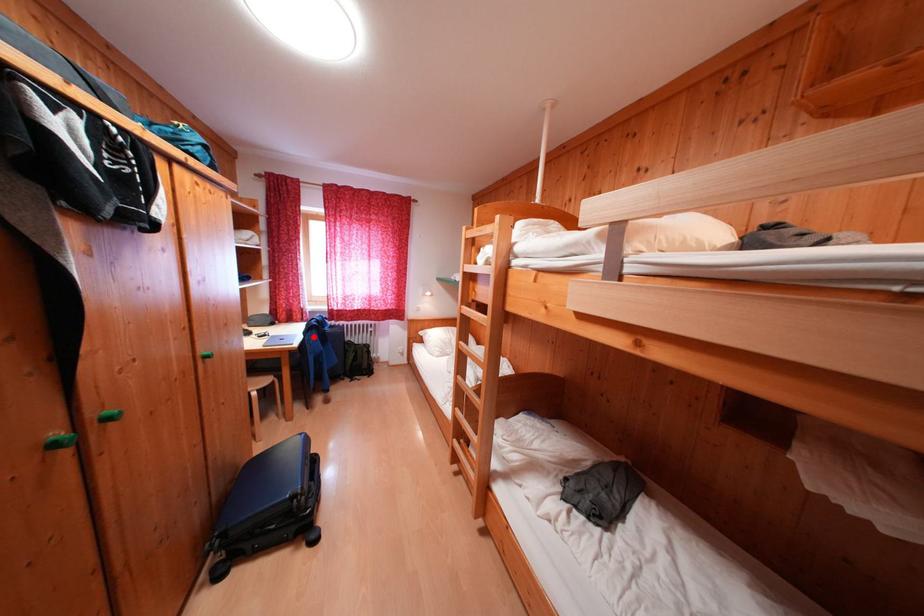
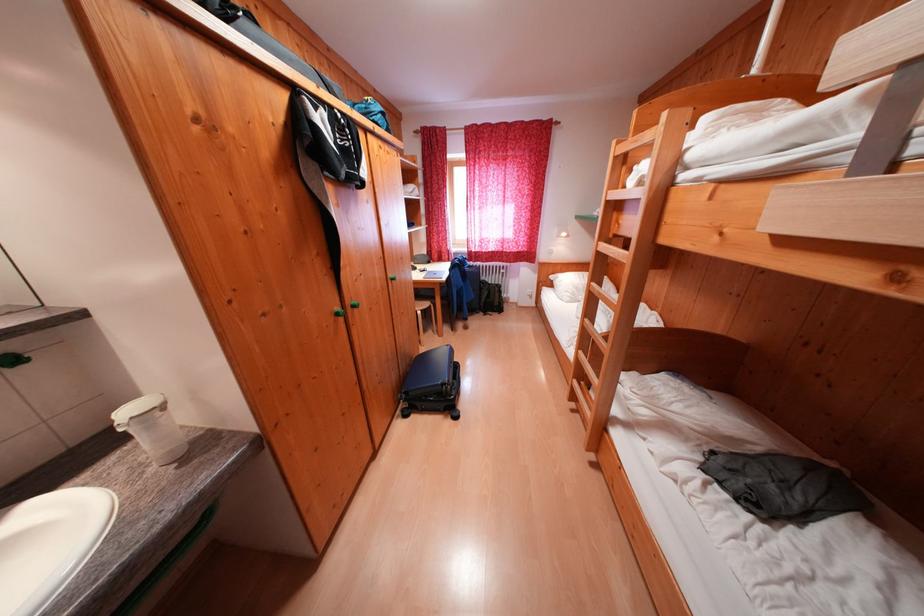
Question: I am providing you with two images of the same scene from different viewpoints. Given a red point in image1, look at the same physical point in image2. Is it:

Choices:
 (A) Closer to the viewpoint
 (B) Farther from the viewpoint

Answer: (B)